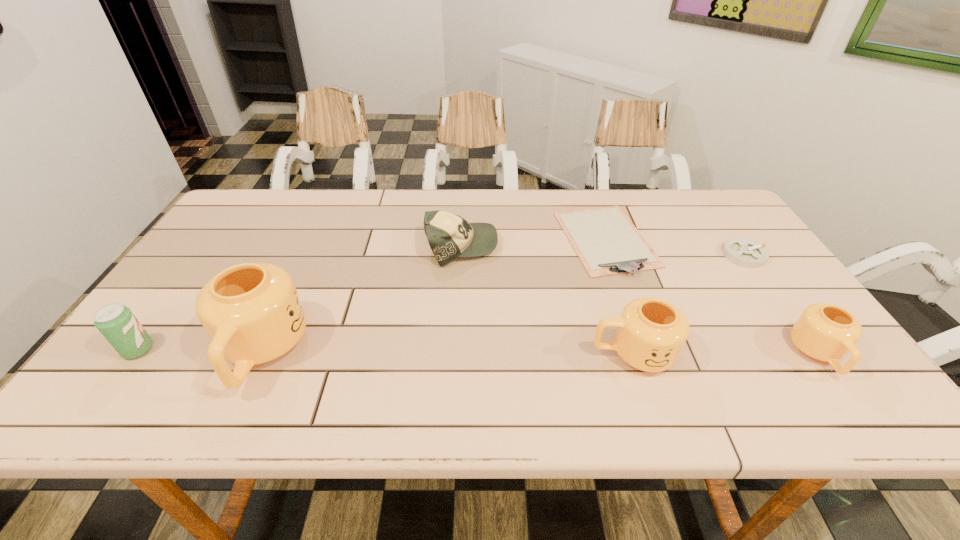
The height and width of the screenshot is (540, 960). Find the location of `mug that is the third nearest to the second shortest object`. mug that is the third nearest to the second shortest object is located at coordinates (252, 313).

The height and width of the screenshot is (540, 960). What are the coordinates of `vacant region that satisfies the following two spatial constraints: 1. on the front side of the shortest object; 2. on the handle side of the second mug from right to left` in the screenshot? It's located at (646, 354).

Where is `free spot that satisfies the following two spatial constraints: 1. on the front-facing side of the baseball cap; 2. on the handle side of the leftmost mug`? The height and width of the screenshot is (540, 960). free spot that satisfies the following two spatial constraints: 1. on the front-facing side of the baseball cap; 2. on the handle side of the leftmost mug is located at coordinates (456, 352).